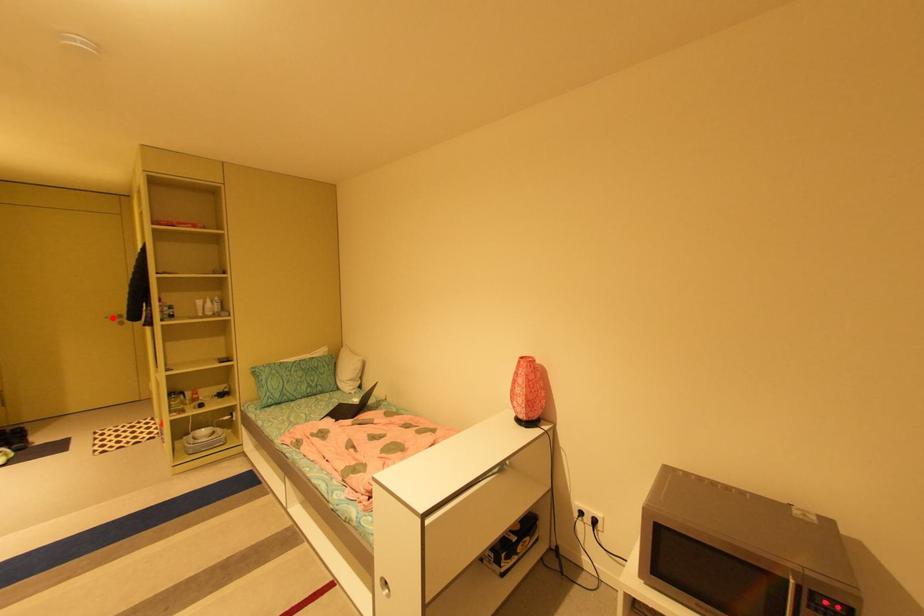
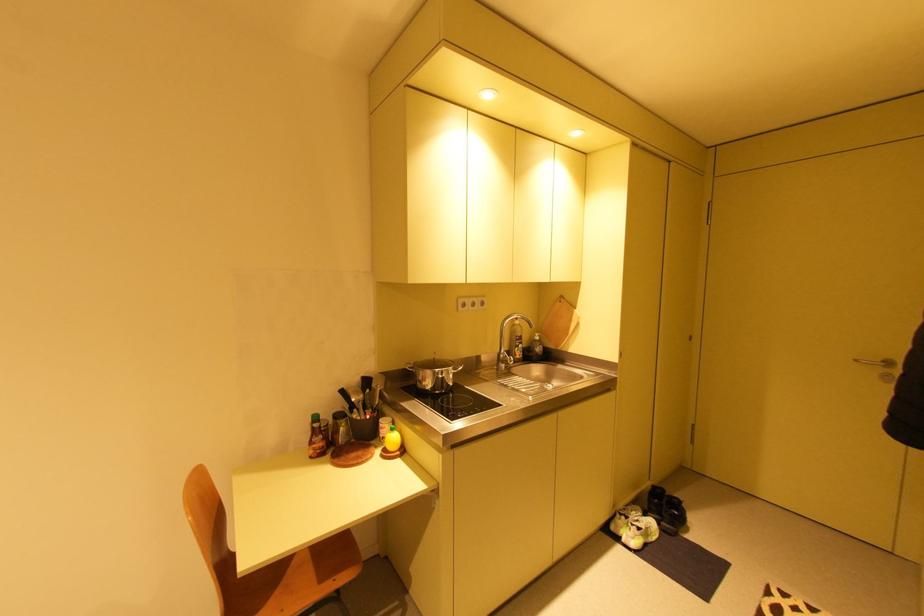
Question: I am providing you with two images of the same scene from different viewpoints. Image1 has a red point marked. In image2, the corresponding 3D location appears at what relative position? Reply with the corresponding letter.

Choices:
 (A) Closer
 (B) Farther

Answer: (B)